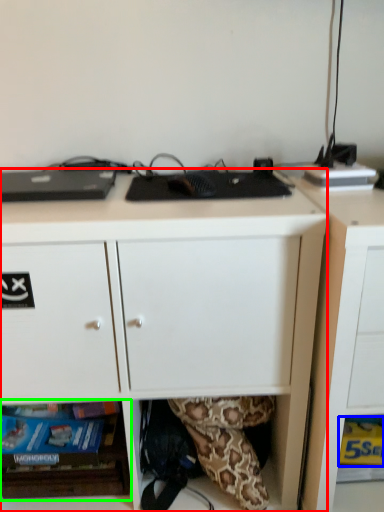
Question: Considering the real-world distances, which object is farthest from desk (highlighted by a red box)? paperback book (highlighted by a blue box) or shelf (highlighted by a green box)?

Choices:
 (A) paperback book
 (B) shelf

Answer: (A)